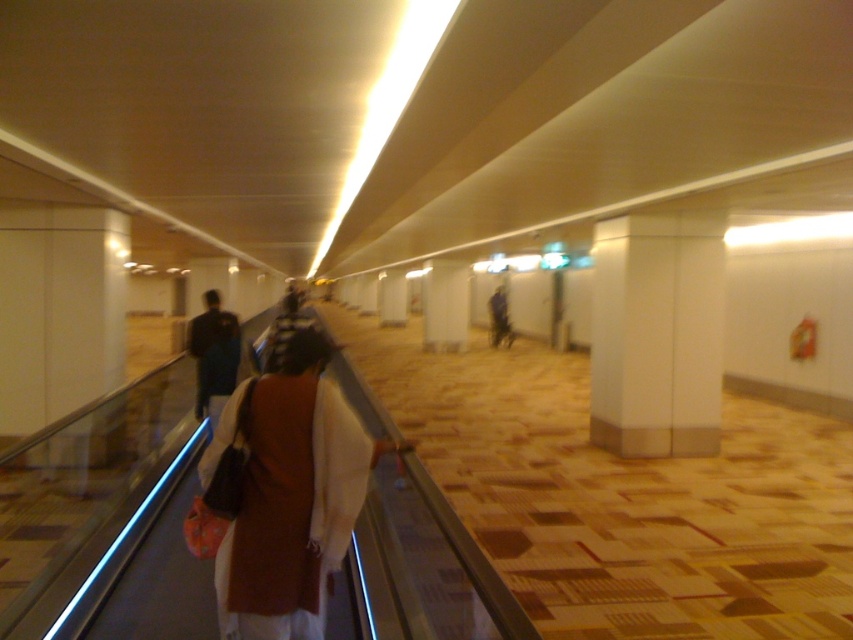
You are standing at the entrance of the corridor and see a brown fabric bag at center and a dark blue jacket at center. Which object is positioned to the left when facing the corridor?

The brown fabric bag at center is positioned to the left of the dark blue jacket at center when facing the corridor.